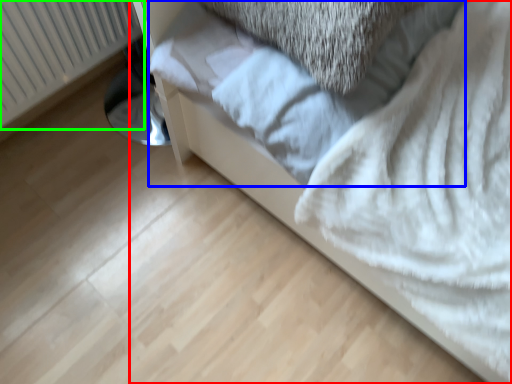
Question: Which object is the closest to the furniture (highlighted by a red box)? Choose among these: sheet (highlighted by a blue box) or radiator (highlighted by a green box).

Choices:
 (A) sheet
 (B) radiator

Answer: (A)